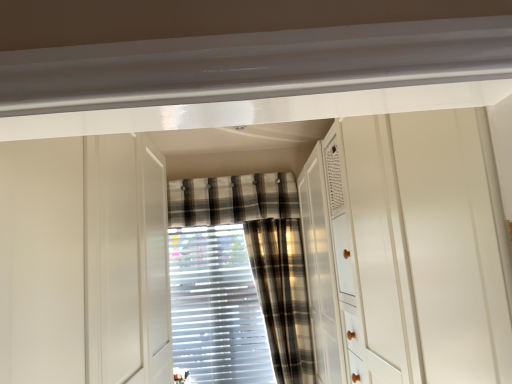
You are a GUI agent. You are given a task and a screenshot of the screen. Output one action in this format:
    pyautogui.click(x=<x>, y=<y>)
    Task: Click on the free point above plaid fabric curtain at center, acting as the 2th curtain starting from the front (from a real-world perspective)
    Image resolution: width=512 pixels, height=384 pixels.
    Given the screenshot: What is the action you would take?
    pos(232,185)